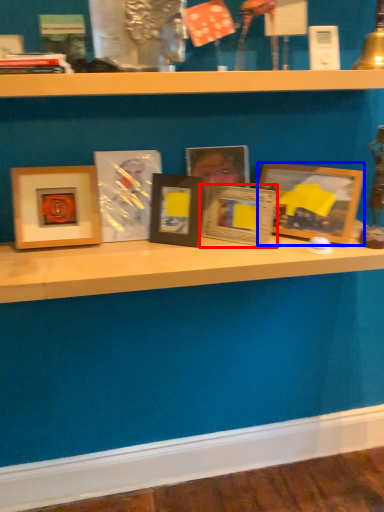
Question: Which object appears closest to the camera in this image, picture frame (highlighted by a red box) or picture frame (highlighted by a blue box)?

Choices:
 (A) picture frame
 (B) picture frame

Answer: (B)